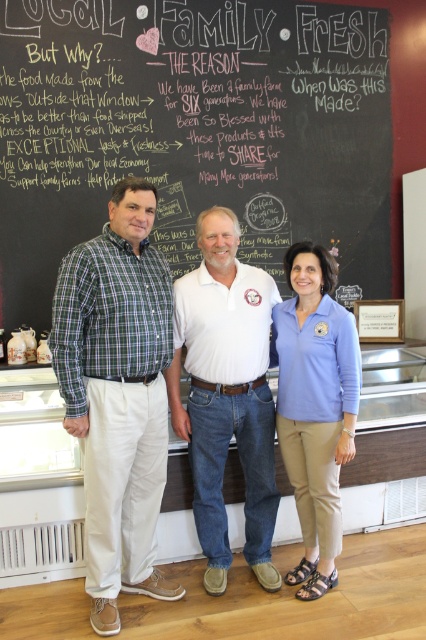
You are a photographer adjusting the lighting for a group photo. You need to ensure that the blue cotton shirt at center and the green plaid shirt at left are both well lit. The minimum distance required between the two shirts for proper lighting is 10 centimeters. Is the current distance sufficient?

The blue cotton shirt at center is 9.01 centimeters from the green plaid shirt at left. Since the required distance is 10 centimeters, the current distance is insufficient for proper lighting.

You are taking a photo of the chalkboard at center and the green plaid shirt at left. Which object should you focus on first if you want to capture both in the frame?

The green plaid shirt at left should be focused on first because the chalkboard at center is positioned to the right of it, so adjusting focus starting from the green plaid shirt at left ensures both are in frame.

You are standing in front of the chalkboard wall and want to take a photo of the blue cotton shirt at center. Which direction should you move to get a better view of the shirt?

Since the blue cotton shirt at center is located at point (164, 392), you should move to the center of the image to get a better view of the shirt.